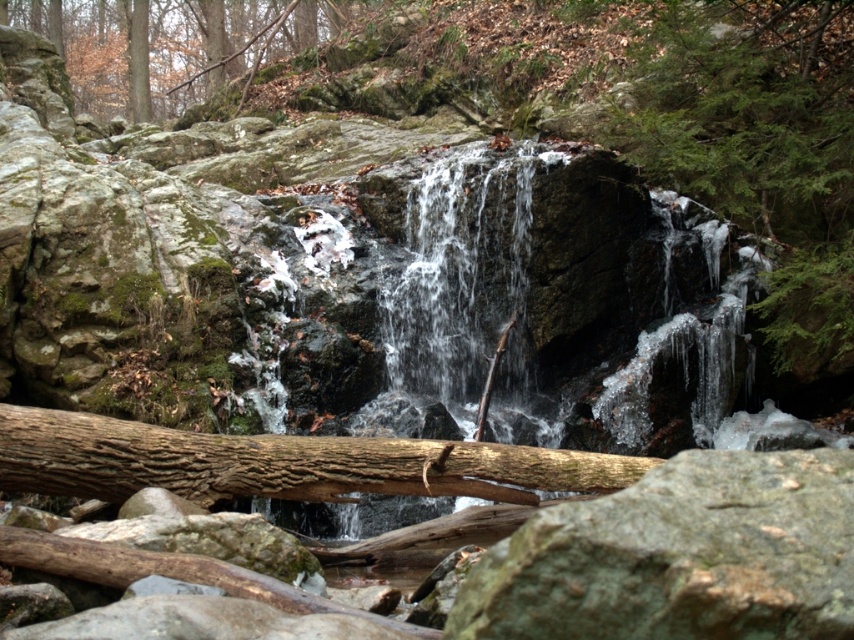
You are standing in front of the waterfall and want to place a small statue between the gray rough rock at center and the green textured rock at right. Which rock should you place it closer to if you want the statue to be more visible to someone approaching from the front?

The gray rough rock at center is closer to the viewer than the green textured rock at right, so placing the statue near the gray rough rock at center would make it more visible to someone approaching from the front.

You are a hiker trying to cross a stream near the waterfall. You see two rocks to step on, the gray rough rock at center and the green mossy rock at upper left. Which rock is narrower and might be riskier to step on?

The gray rough rock at center is thinner than the green mossy rock at upper left, so it is narrower and riskier to step on.

You are a hiker trying to navigate to the waterfall. You see the gray rough rock at center and the green mossy rock at upper left. Which rock is closer to your current position?

The gray rough rock at center is 36.22 meters away from the green mossy rock at upper left. Without knowing your exact position, it is impossible to determine which is closer.